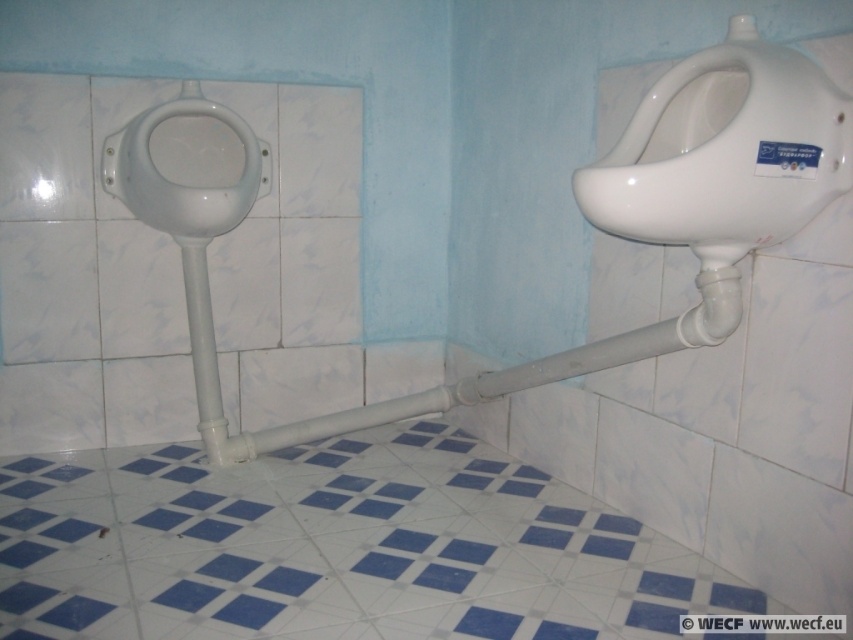
Question: Does white glossy pipe at center lie behind white glossy bidet at left?

Choices:
 (A) yes
 (B) no

Answer: (B)

Question: Which point is closer to the camera?

Choices:
 (A) white glossy pipe at center
 (B) white glossy bidet at left

Answer: (A)

Question: Is white glossy pipe at center smaller than white glossy bidet at left?

Choices:
 (A) yes
 (B) no

Answer: (B)

Question: Does white glossy pipe at center have a lesser width compared to white glossy bidet at left?

Choices:
 (A) no
 (B) yes

Answer: (A)

Question: Which point is farther from the camera taking this photo?

Choices:
 (A) click(213, 396)
 (B) click(102, 161)

Answer: (A)